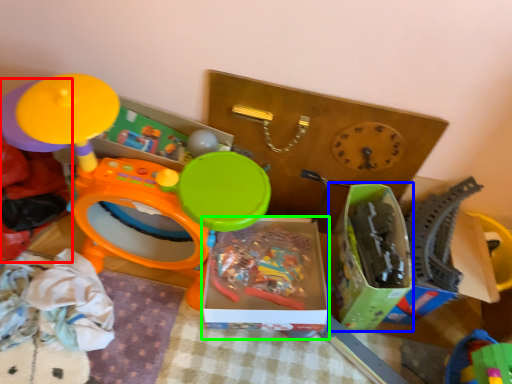
Question: Which object is positioned closest to toy (highlighted by a red box)? Select from storage box (highlighted by a blue box) and storage box (highlighted by a green box).

Choices:
 (A) storage box
 (B) storage box

Answer: (B)